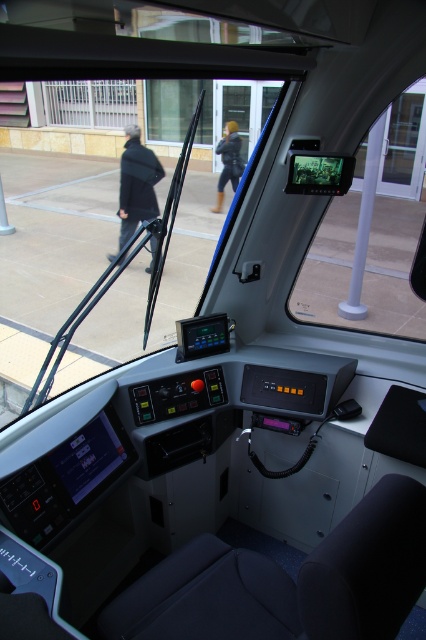
What is located at the point with coordinates (x=137, y=184) in the driver cabin?

The point at coordinates (x=137, y=184) is located on the black matte coat at left.

You are a train operator sitting in the driver seat. You need to check the transparent glass monitor at upper center and the leather boots at center. Which object is closer to you?

The transparent glass monitor at upper center is closer to you because it is in front of the leather boots at center.

You are a passenger in the vehicle and notice two items through the windshield. You see the black matte coat at left and the leather boots at center. Which item is closer to the vehicle?

The black matte coat at left is closer to the vehicle because it is in front of the leather boots at center.